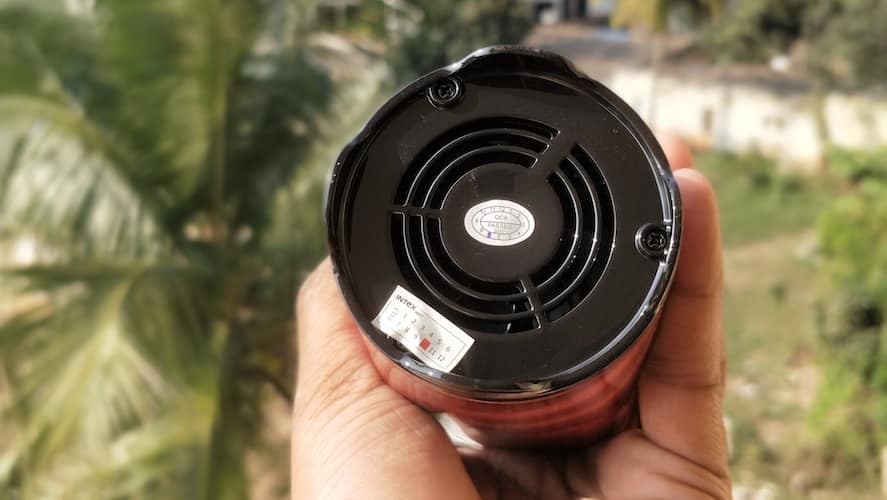
Locate an element on the screen. This screenshot has height=500, width=887. screws is located at coordinates point(655,238), point(446,87), point(398,347).